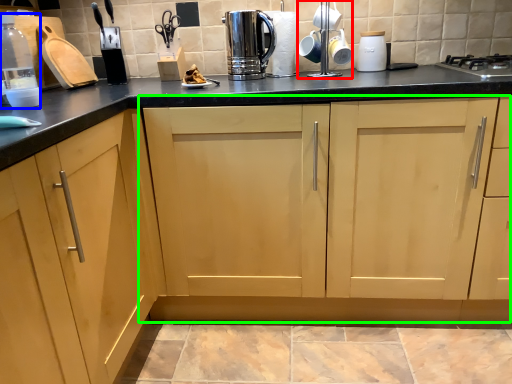
Question: Which is farther away from appliance (highlighted by a red box)? bottle (highlighted by a blue box) or cabinetry (highlighted by a green box)?

Choices:
 (A) bottle
 (B) cabinetry

Answer: (A)